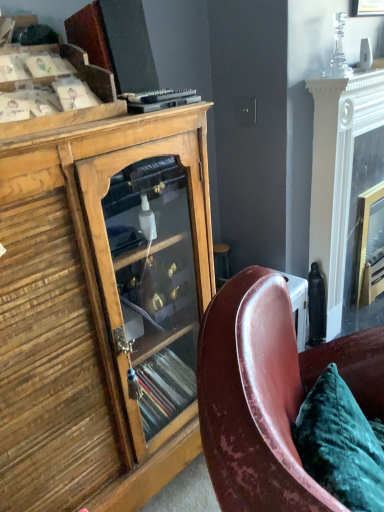
Where is `velvet green pillow at lower right`? This screenshot has height=512, width=384. velvet green pillow at lower right is located at coordinates (341, 444).

At what (x,y) coordinates should I click in order to perform the action: click on wooden cabinet at left. Please return your answer as a coordinate pair (x, y). Looking at the image, I should click on (101, 309).

Based on their sizes in the image, would you say wooden cabinet at left is bigger or smaller than black plastic remote control at upper center?

Clearly, wooden cabinet at left is larger in size than black plastic remote control at upper center.

From the image's perspective, who appears lower, wooden cabinet at left or black plastic remote control at upper center?

From the image's view, wooden cabinet at left is below.

In the image, there is a black plastic remote control at upper center. Find the location of `cabinetry below it (from a real-world perspective)`. cabinetry below it (from a real-world perspective) is located at coordinates (101, 309).

Between point (91, 163) and point (153, 100), which one is positioned behind?

Point (153, 100)

Which of these two, wooden cabinet at left or wooden cabinet at upper left, is thinner?

wooden cabinet at upper left.

Considering the relative sizes of wooden cabinet at left and wooden cabinet at upper left in the image provided, is wooden cabinet at left shorter than wooden cabinet at upper left?

No.

Who is more distant, wooden cabinet at left or wooden cabinet at upper left?

wooden cabinet at upper left is behind.

Who is smaller, wooden cabinet at upper left or leather at right?

With smaller size is wooden cabinet at upper left.

From the image's perspective, is wooden cabinet at upper left above or below leather at right?

From the image's perspective, wooden cabinet at upper left appears above leather at right.

Considering the relative sizes of leather at right and black plastic remote control at upper center in the image provided, is leather at right bigger than black plastic remote control at upper center?

Yes.

Based on the photo, between leather at right and black plastic remote control at upper center, which one is positioned behind?

black plastic remote control at upper center is more distant.

From the image's perspective, relative to black plastic remote control at upper center, is leather at right above or below?

Based on their image positions, leather at right is located beneath black plastic remote control at upper center.

Is black plastic remote control at upper center located within leather at right?

No, black plastic remote control at upper center is located outside of leather at right.

Considering the sizes of black plastic remote control at upper center and wooden cabinet at upper left in the image, is black plastic remote control at upper center taller or shorter than wooden cabinet at upper left?

Considering their sizes, black plastic remote control at upper center has less height than wooden cabinet at upper left.

Is point (173, 97) more distant than point (118, 103)?

Yes, it is behind point (118, 103).

From the image's perspective, relative to leather at right, is velvet green pillow at lower right above or below?

velvet green pillow at lower right is situated higher than leather at right in the image.

Is velvet green pillow at lower right aimed at leather at right?

Yes, velvet green pillow at lower right is aimed at leather at right.

From the picture: From a real-world perspective, is velvet green pillow at lower right located higher than leather at right?

Yes, from a real-world perspective, velvet green pillow at lower right is on top of leather at right.

Is velvet green pillow at lower right next to leather at right and touching it?

No, velvet green pillow at lower right is not making contact with leather at right.

From a real-world perspective, is black plastic remote control at upper center on white glossy fireplace at right?

Yes, from a real-world perspective, black plastic remote control at upper center is above white glossy fireplace at right.

Consider the image. Are black plastic remote control at upper center and white glossy fireplace at right located far from each other?

They are positioned close to each other.

Based on their positions, is black plastic remote control at upper center located to the left or right of white glossy fireplace at right?

Based on their positions, black plastic remote control at upper center is located to the left of white glossy fireplace at right.

Identify the location of remote control above the wooden cabinet at left (from the image's perspective). The image size is (384, 512). (158, 96).

What are the coordinates of `shelf that appears above the wooden cabinet at left (from a real-world perspective)` in the screenshot? It's located at (74, 110).

Looking at the image, which one is located closer to black plastic remote control at upper center, wooden cabinet at upper left or velvet green pillow at lower right?

The object closer to black plastic remote control at upper center is wooden cabinet at upper left.

Looking at the image, which one is located closer to white glossy fireplace at right, wooden cabinet at left or velvet green pillow at lower right?

wooden cabinet at left is positioned closer to the anchor white glossy fireplace at right.

Looking at the image, which one is located further to black plastic remote control at upper center, wooden cabinet at left or leather at right?

leather at right is further to black plastic remote control at upper center.

Estimate the real-world distances between objects in this image. Which object is closer to black plastic remote control at upper center, velvet green pillow at lower right or white glossy fireplace at right?

Based on the image, velvet green pillow at lower right appears to be nearer to black plastic remote control at upper center.

Looking at the image, which one is located closer to black plastic remote control at upper center, white glossy fireplace at right or leather at right?

The object closer to black plastic remote control at upper center is leather at right.

Estimate the real-world distances between objects in this image. Which object is further from velvet green pillow at lower right, white glossy fireplace at right or wooden cabinet at left?

Among the two, white glossy fireplace at right is located further to velvet green pillow at lower right.

Estimate the real-world distances between objects in this image. Which object is further from wooden cabinet at left, velvet green pillow at lower right or black plastic remote control at upper center?

velvet green pillow at lower right is positioned further to the anchor wooden cabinet at left.

Based on their spatial positions, is black plastic remote control at upper center or wooden cabinet at upper left further from wooden cabinet at left?

black plastic remote control at upper center is positioned further to the anchor wooden cabinet at left.

I want to click on cabinetry between wooden cabinet at upper left and white glossy fireplace at right in the horizontal direction, so click(101, 309).

Image resolution: width=384 pixels, height=512 pixels. In order to click on remote control positioned between velvet green pillow at lower right and white glossy fireplace at right from near to far in this screenshot , I will do `click(158, 96)`.

The width and height of the screenshot is (384, 512). Identify the location of cabinetry between black plastic remote control at upper center and leather at right from top to bottom. (101, 309).

At what (x,y) coordinates should I click in order to perform the action: click on pillow between black plastic remote control at upper center and leather at right in the up-down direction. Please return your answer as a coordinate pair (x, y). Looking at the image, I should click on (341, 444).